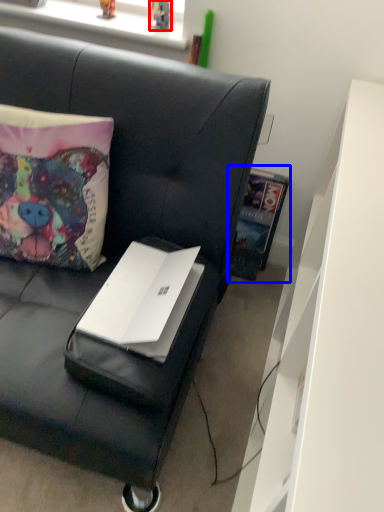
Question: Which point is closer to the camera, toy (highlighted by a red box) or book (highlighted by a blue box)?

Choices:
 (A) toy
 (B) book

Answer: (A)